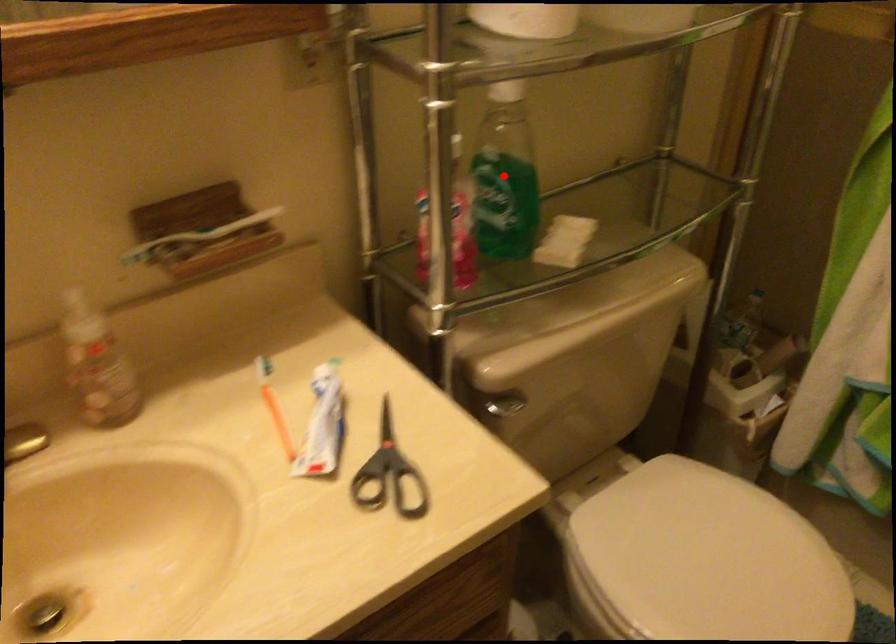
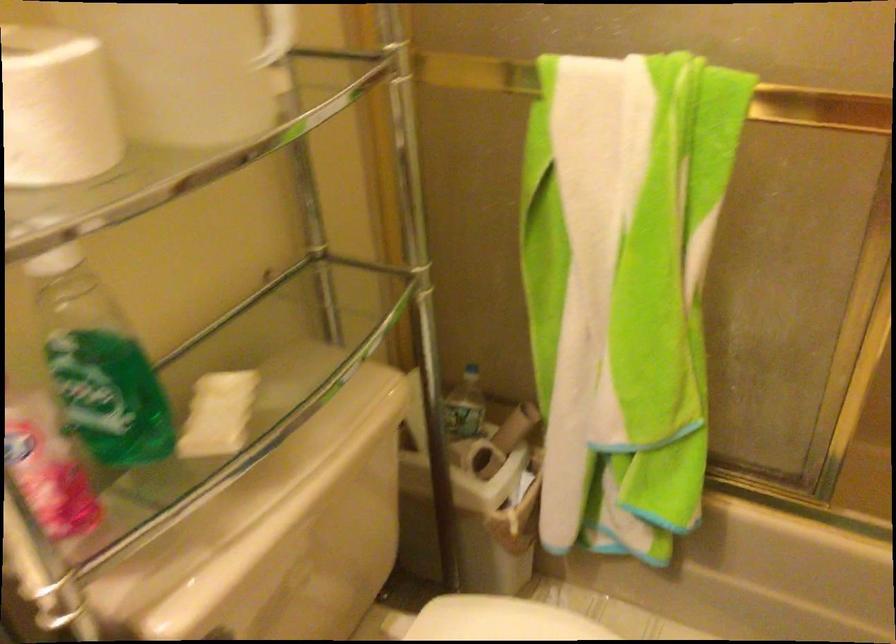
Locate, in the second image, the point that corresponds to the highlighted location in the first image.

(98, 365)